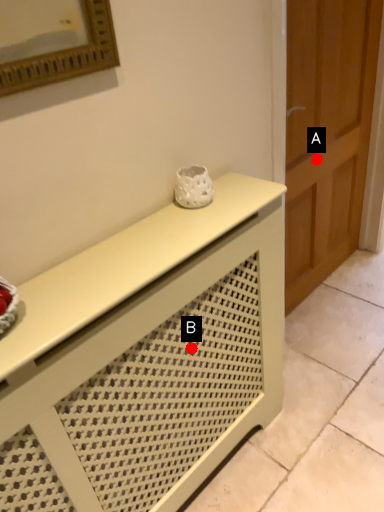
Question: Two points are circled on the image, labeled by A and B beside each circle. Which of the following is the farthest from the observer?

Choices:
 (A) A is further
 (B) B is further

Answer: (A)